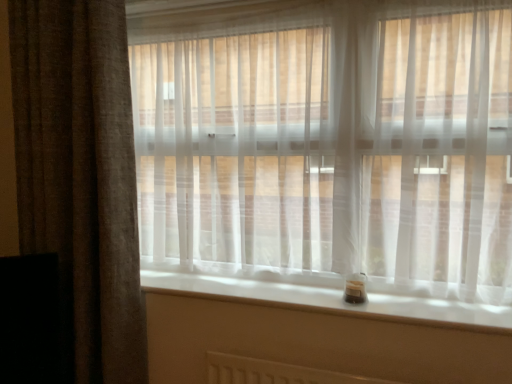
Question: Is white smooth window sill at lower center next to translucent white curtain at center, arranged as the second curtain when viewed from the left, and touching it?

Choices:
 (A) no
 (B) yes

Answer: (A)

Question: Does white smooth window sill at lower center turn towards translucent white curtain at center, placed as the 1th curtain when sorted from right to left?

Choices:
 (A) no
 (B) yes

Answer: (A)

Question: Is white smooth window sill at lower center taller than translucent white curtain at center, arranged as the second curtain when viewed from the left?

Choices:
 (A) no
 (B) yes

Answer: (A)

Question: Considering the relative positions of white smooth window sill at lower center and translucent white curtain at center, placed as the 1th curtain when sorted from right to left, in the image provided, is white smooth window sill at lower center to the left of translucent white curtain at center, placed as the 1th curtain when sorted from right to left, from the viewer's perspective?

Choices:
 (A) yes
 (B) no

Answer: (B)

Question: Does white smooth window sill at lower center have a larger size compared to translucent white curtain at center, arranged as the second curtain when viewed from the left?

Choices:
 (A) yes
 (B) no

Answer: (B)

Question: From a real-world perspective, is white smooth window sill at lower center positioned under translucent white curtain at center, placed as the 1th curtain when sorted from right to left, based on gravity?

Choices:
 (A) yes
 (B) no

Answer: (A)

Question: Are brown textured curtain at left, acting as the 1th curtain starting from the left, and translucent white curtain at center, arranged as the second curtain when viewed from the left, beside each other?

Choices:
 (A) no
 (B) yes

Answer: (A)

Question: Is brown textured curtain at left, arranged as the 2th curtain when viewed from the right, thinner than translucent white curtain at center, arranged as the second curtain when viewed from the left?

Choices:
 (A) yes
 (B) no

Answer: (B)

Question: From the image's perspective, is brown textured curtain at left, arranged as the 2th curtain when viewed from the right, beneath translucent white curtain at center, placed as the 1th curtain when sorted from right to left?

Choices:
 (A) yes
 (B) no

Answer: (A)

Question: Can you confirm if brown textured curtain at left, acting as the 1th curtain starting from the left, is positioned to the right of translucent white curtain at center, placed as the 1th curtain when sorted from right to left?

Choices:
 (A) no
 (B) yes

Answer: (A)

Question: From a real-world perspective, is brown textured curtain at left, arranged as the 2th curtain when viewed from the right, positioned under translucent white curtain at center, arranged as the second curtain when viewed from the left, based on gravity?

Choices:
 (A) no
 (B) yes

Answer: (B)

Question: Could you tell me if brown textured curtain at left, arranged as the 2th curtain when viewed from the right, is turned towards translucent white curtain at center, arranged as the second curtain when viewed from the left?

Choices:
 (A) yes
 (B) no

Answer: (B)

Question: Is translucent white curtain at center, arranged as the second curtain when viewed from the left, with brown textured curtain at left, acting as the 1th curtain starting from the left?

Choices:
 (A) yes
 (B) no

Answer: (B)